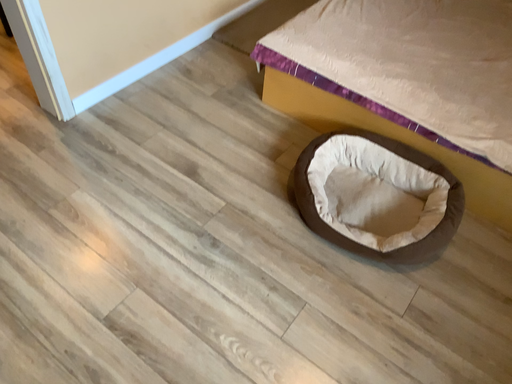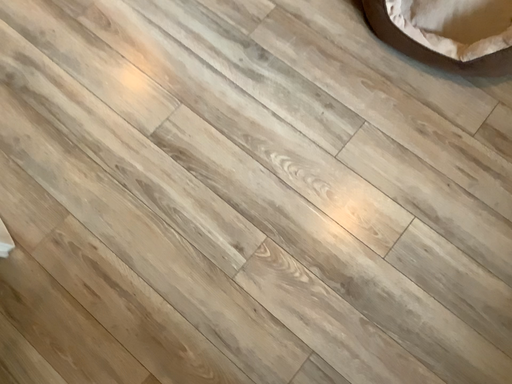
Question: How did the camera likely rotate when shooting the video?

Choices:
 (A) rotated upward
 (B) rotated downward

Answer: (B)